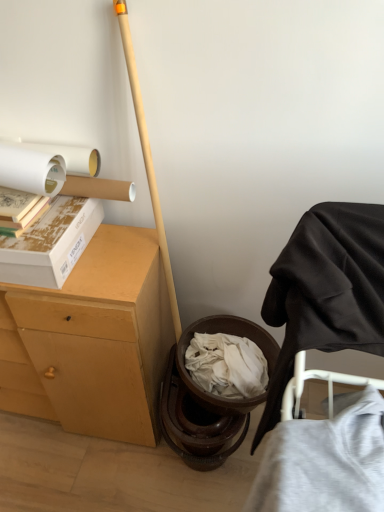
Question: From a real-world perspective, relative to matte cardboard book at upper left, is gray cotton t-shirt at lower right vertically above or below?

Choices:
 (A) below
 (B) above

Answer: (A)

Question: Visually, is gray cotton t-shirt at lower right positioned to the left or to the right of matte cardboard book at upper left?

Choices:
 (A) left
 (B) right

Answer: (B)

Question: Which is farther from the matte cardboard book at upper left?

Choices:
 (A) light brown wood desk at left
 (B) black fabric chair at right
 (C) white matte toilet paper at upper left
 (D) white cardboard box at upper left
 (E) gray cotton t-shirt at lower right

Answer: (E)

Question: Which object is the closest to the white cardboard box at upper left?

Choices:
 (A) matte cardboard book at upper left
 (B) light brown wood desk at left
 (C) white matte toilet paper at upper left
 (D) gray cotton t-shirt at lower right
 (E) black fabric chair at right

Answer: (A)